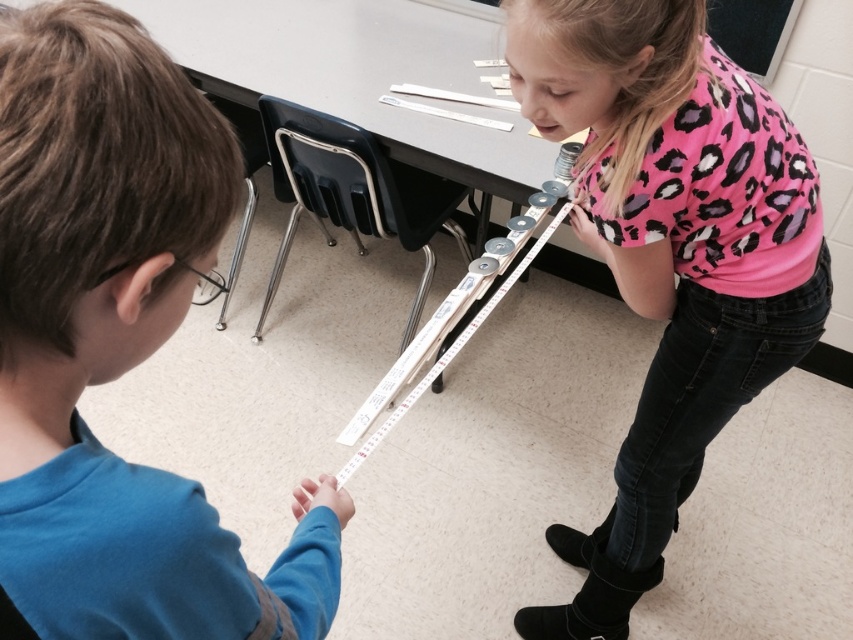
You are a teacher observing the classroom and want to ensure both children are visible to the camera positioned at the front of the room. Which child, the blue fabric shirt at lower left or the pink leopard print shirt at upper right, is more likely to be in the camera frame?

The blue fabric shirt at lower left is closer to the viewer than the pink leopard print shirt at upper right, so the blue fabric shirt at lower left is more likely to be in the camera frame.